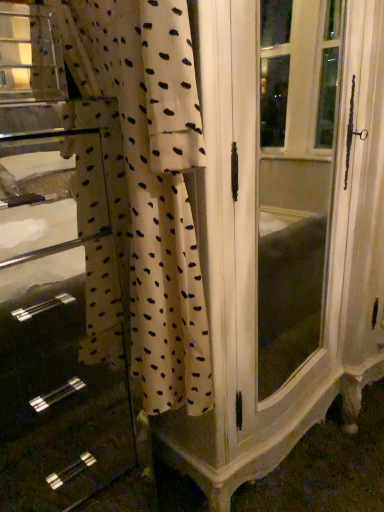
What do you see at coordinates (141, 191) in the screenshot? I see `white dotted fabric at center` at bounding box center [141, 191].

What are the coordinates of `white dotted fabric at center` in the screenshot? It's located at (141, 191).

Measure the distance between white fabric at left and camera.

A distance of 3.50 feet exists between white fabric at left and camera.

At what (x,y) coordinates should I click in order to perform the action: click on white fabric at left. Please return your answer as a coordinate pair (x, y). The width and height of the screenshot is (384, 512). Looking at the image, I should click on (55, 366).

What do you see at coordinates (55, 366) in the screenshot? Image resolution: width=384 pixels, height=512 pixels. I see `white fabric at left` at bounding box center [55, 366].

Where is `white dotted fabric at center`? The image size is (384, 512). white dotted fabric at center is located at coordinates (141, 191).

Which is more to the right, white dotted fabric at center or white fabric at left?

white dotted fabric at center is more to the right.

Considering the positions of objects white dotted fabric at center and white fabric at left in the image provided, who is in front, white dotted fabric at center or white fabric at left?

white dotted fabric at center is closer to the camera.

Is point (97, 300) positioned in front of point (18, 303)?

Yes, point (97, 300) is in front of point (18, 303).

From the image's perspective, would you say white dotted fabric at center is positioned over white fabric at left?

Indeed, from the image's perspective, white dotted fabric at center is shown above white fabric at left.

From a real-world perspective, which is physically below, white dotted fabric at center or white fabric at left?

From a 3D spatial view, white fabric at left is below.

Considering the relative sizes of white dotted fabric at center and white fabric at left in the image provided, is white dotted fabric at center thinner than white fabric at left?

Yes.

Does white dotted fabric at center have a lesser height compared to white fabric at left?

Yes.

Who is smaller, white dotted fabric at center or white fabric at left?

white dotted fabric at center.

Can white fabric at left be found inside white dotted fabric at center?

No, white fabric at left is not inside white dotted fabric at center.

Are white dotted fabric at center and white fabric at left located far from each other?

No.

Is white dotted fabric at center facing towards white fabric at left?

Yes, white dotted fabric at center is oriented towards white fabric at left.

Can you tell me how much white dotted fabric at center and white fabric at left differ in facing direction?

The angular difference between white dotted fabric at center and white fabric at left is 90 degrees.

Measure the distance from white dotted fabric at center to white fabric at left.

white dotted fabric at center is 73.79 centimeters away from white fabric at left.

Locate an element on the screen. This screenshot has height=512, width=384. curtain above the white fabric at left (from a real-world perspective) is located at coordinates (141, 191).

In the image, is white fabric at left on the left side or the right side of white dotted fabric at center?

→ In the image, white fabric at left appears on the left side of white dotted fabric at center.

Considering the relative positions of white fabric at left and white dotted fabric at center in the image provided, is white fabric at left in front of white dotted fabric at center?

No, white fabric at left is further to the viewer.

Considering the positions of points (92, 403) and (83, 122), is point (92, 403) farther from camera compared to point (83, 122)?

Yes, it is.

Based on the photo, from the image's perspective, is white fabric at left located above or below white dotted fabric at center?

white fabric at left is below white dotted fabric at center.

In the scene shown: From a real-world perspective, which is physically above, white fabric at left or white dotted fabric at center?

white dotted fabric at center is physically above.

Is white fabric at left wider than white dotted fabric at center?

Yes.

Considering the sizes of white fabric at left and white dotted fabric at center in the image, is white fabric at left taller or shorter than white dotted fabric at center?

white fabric at left is taller than white dotted fabric at center.

Considering the relative sizes of white fabric at left and white dotted fabric at center in the image provided, is white fabric at left smaller than white dotted fabric at center?

No.

Is white dotted fabric at center a part of white fabric at left?

Yes, white fabric at left contains white dotted fabric at center.

Is white fabric at left with white dotted fabric at center?

No, white fabric at left is not making contact with white dotted fabric at center.

Is white fabric at left oriented towards white dotted fabric at center?

Yes, white fabric at left faces towards white dotted fabric at center.

How many degrees apart are the facing directions of white fabric at left and white dotted fabric at center?

white fabric at left and white dotted fabric at center are facing 90 degrees away from each other.

What are the coordinates of `curtain located above the white fabric at left (from a real-world perspective)` in the screenshot? It's located at (141, 191).

Image resolution: width=384 pixels, height=512 pixels. Identify the location of file cabinet beneath the white dotted fabric at center (from a real-world perspective). (55, 366).

In the image, there is a white fabric at left. What are the coordinates of `curtain above it (from the image's perspective)` in the screenshot? It's located at (141, 191).